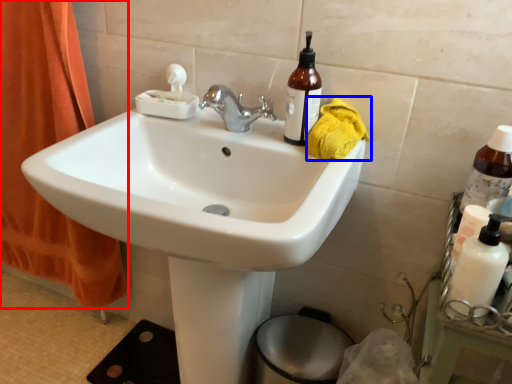
Question: Which object is further to the camera taking this photo, curtain (highlighted by a red box) or material (highlighted by a blue box)?

Choices:
 (A) curtain
 (B) material

Answer: (A)